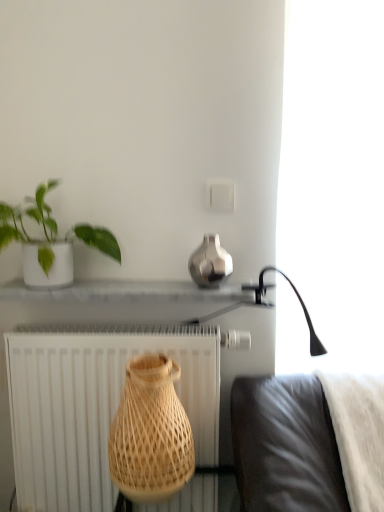
Question: Does white glossy shelf at center appear on the left side of green matte plant at upper left?

Choices:
 (A) yes
 (B) no

Answer: (B)

Question: Considering the relative sizes of white glossy shelf at center and green matte plant at upper left in the image provided, is white glossy shelf at center thinner than green matte plant at upper left?

Choices:
 (A) no
 (B) yes

Answer: (B)

Question: Is white glossy shelf at center positioned before green matte plant at upper left?

Choices:
 (A) yes
 (B) no

Answer: (B)

Question: Considering the relative sizes of white glossy shelf at center and green matte plant at upper left in the image provided, is white glossy shelf at center taller than green matte plant at upper left?

Choices:
 (A) yes
 (B) no

Answer: (B)

Question: Is white glossy shelf at center located outside green matte plant at upper left?

Choices:
 (A) yes
 (B) no

Answer: (A)

Question: Is white glossy shelf at center next to green matte plant at upper left?

Choices:
 (A) no
 (B) yes

Answer: (A)

Question: Is natural wood vase at center, placed as the second vase when sorted from right to left, looking in the opposite direction of white fluffy blanket at lower right?

Choices:
 (A) yes
 (B) no

Answer: (B)

Question: Considering the relative sizes of natural wood vase at center, which ranks as the first vase in left-to-right order, and white fluffy blanket at lower right in the image provided, is natural wood vase at center, which ranks as the first vase in left-to-right order, shorter than white fluffy blanket at lower right?

Choices:
 (A) yes
 (B) no

Answer: (A)

Question: Does natural wood vase at center, which ranks as the second vase in top-to-bottom order, appear on the left side of white fluffy blanket at lower right?

Choices:
 (A) no
 (B) yes

Answer: (B)

Question: From a real-world perspective, is natural wood vase at center, which is the first vase in bottom-to-top order, located higher than white fluffy blanket at lower right?

Choices:
 (A) no
 (B) yes

Answer: (B)

Question: Is natural wood vase at center, which ranks as the second vase in top-to-bottom order, outside white fluffy blanket at lower right?

Choices:
 (A) no
 (B) yes

Answer: (B)

Question: Would you say white fluffy blanket at lower right is part of natural wood vase at center, which is the first vase in bottom-to-top order,'s contents?

Choices:
 (A) no
 (B) yes

Answer: (A)

Question: From the image's perspective, is white fluffy blanket at lower right on green matte plant at upper left?

Choices:
 (A) yes
 (B) no

Answer: (B)